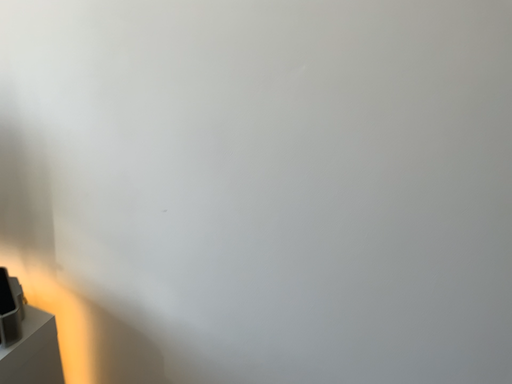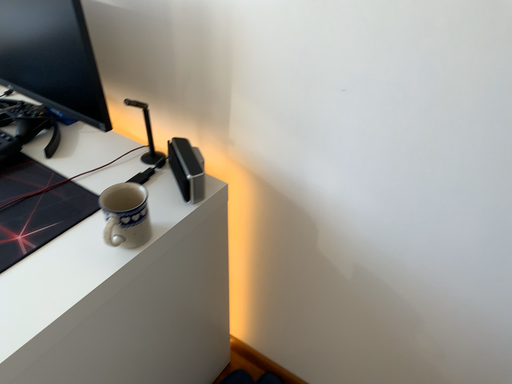
Question: How did the camera likely rotate when shooting the video?

Choices:
 (A) rotated downward
 (B) rotated upward

Answer: (A)